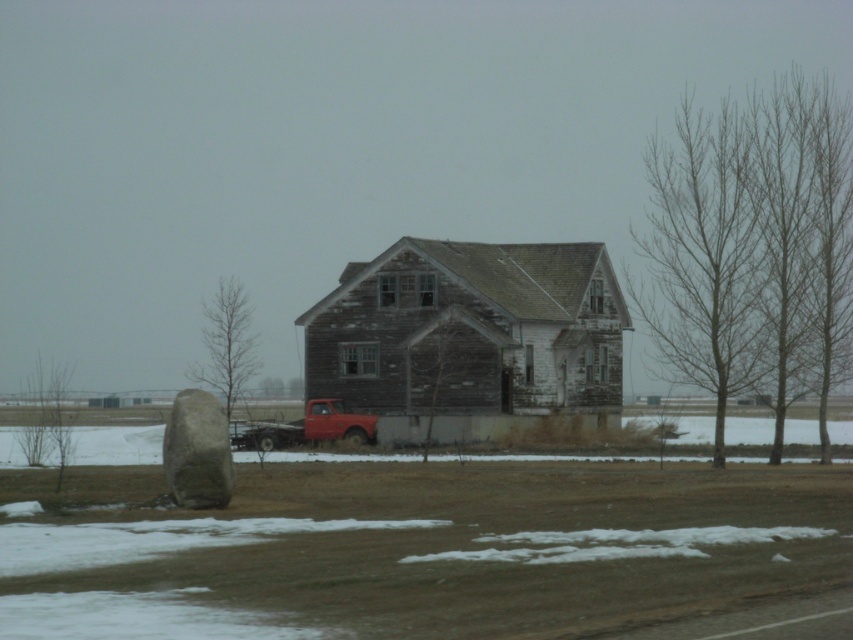
You are standing at the edge of the field in front of the old wooden house. You see a smooth gray rock at lower left and a matte red truck at center. Which object takes up more space in the scene?

The smooth gray rock at lower left is larger in size than the matte red truck at center, so it takes up more space in the scene.

You are a delivery person trying to reach the matte red truck at center. There is a smooth gray rock at lower left in your path. Can you easily drive around it? Please explain why.

The smooth gray rock at lower left is positioned over the matte red truck at center, meaning it is directly above the truck. Since the rock is overhead, you cannot drive around it as it would block the path vertically.

You are standing at the edge of the field looking towards the weathered wood barn at center and the smooth gray rock at lower left. Which object is closer to you?

The smooth gray rock at lower left is behind the weathered wood barn at center, so the weathered wood barn at center is closer to you.